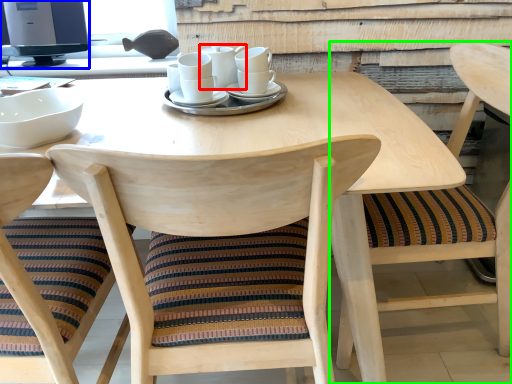
Question: Which object is positioned farthest from tableware (highlighted by a red box)? Select from computer monitor (highlighted by a blue box) and chair (highlighted by a green box).

Choices:
 (A) computer monitor
 (B) chair

Answer: (A)